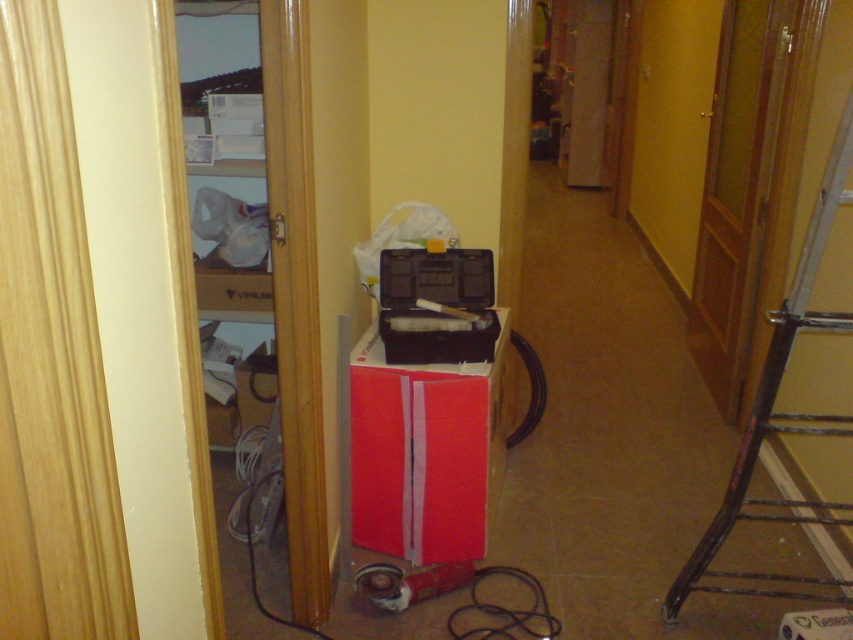
Which is more to the right, red cardboard box at center or metallic black ladder at right?

From the viewer's perspective, metallic black ladder at right appears more on the right side.

Is red cardboard box at center wider than metallic black ladder at right?

No, red cardboard box at center is not wider than metallic black ladder at right.

Is point (395, 392) more distant than point (750, 417)?

Yes, point (395, 392) is farther from viewer.

I want to click on red cardboard box at center, so click(x=422, y=452).